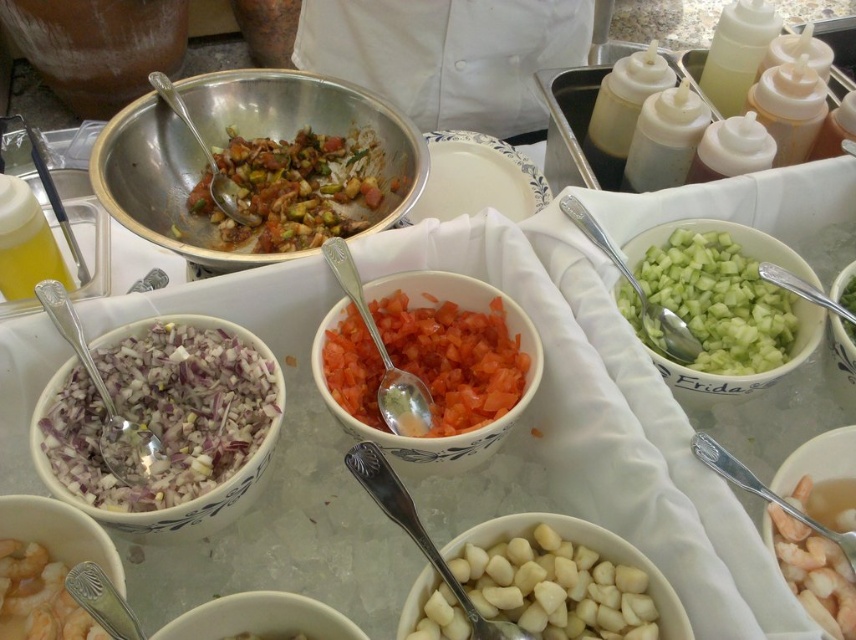
Is white glossy onion at left positioned before green translucent bowl at center right?

Yes, it is in front of green translucent bowl at center right.

Does white glossy onion at left have a lesser width compared to green translucent bowl at center right?

Yes.

The height and width of the screenshot is (640, 856). I want to click on white glossy onion at left, so click(165, 422).

The image size is (856, 640). Identify the location of white glossy onion at left. (165, 422).

Is point (370, 104) less distant than point (849, 282)?

No, it is behind (849, 282).

Who is positioned more to the left, stainless steel bowl at center or green leafy vegetable at center?

stainless steel bowl at center

Find the location of a particular element. This screenshot has height=640, width=856. stainless steel bowl at center is located at coordinates (308, 120).

Who is positioned more to the left, white glossy garlic at center or green translucent bowl at center right?

Positioned to the left is white glossy garlic at center.

Is white glossy garlic at center below green translucent bowl at center right?

Yes, white glossy garlic at center is below green translucent bowl at center right.

Does point (531, 582) come in front of point (739, 378)?

Yes, point (531, 582) is closer to viewer.

Identify the location of white glossy garlic at center. (556, 584).